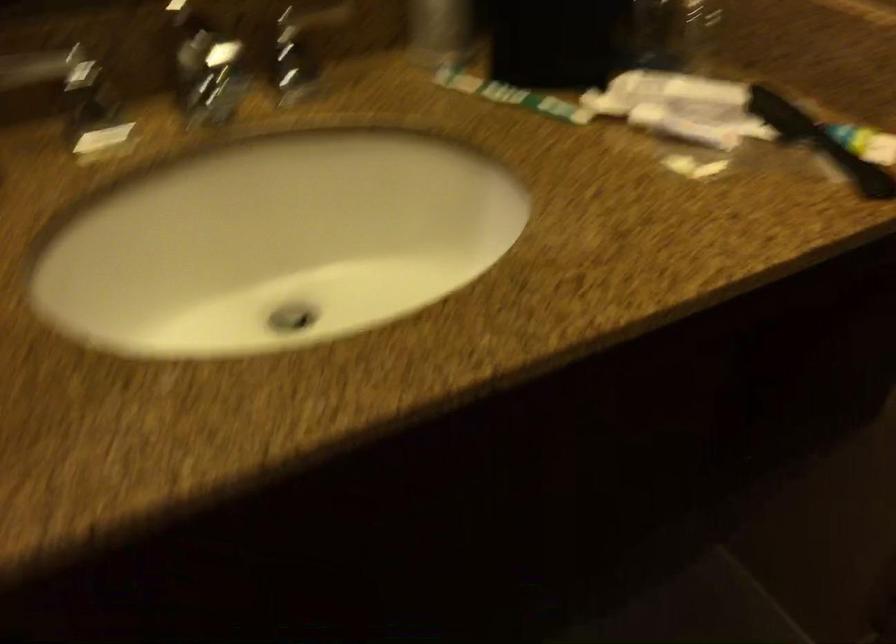
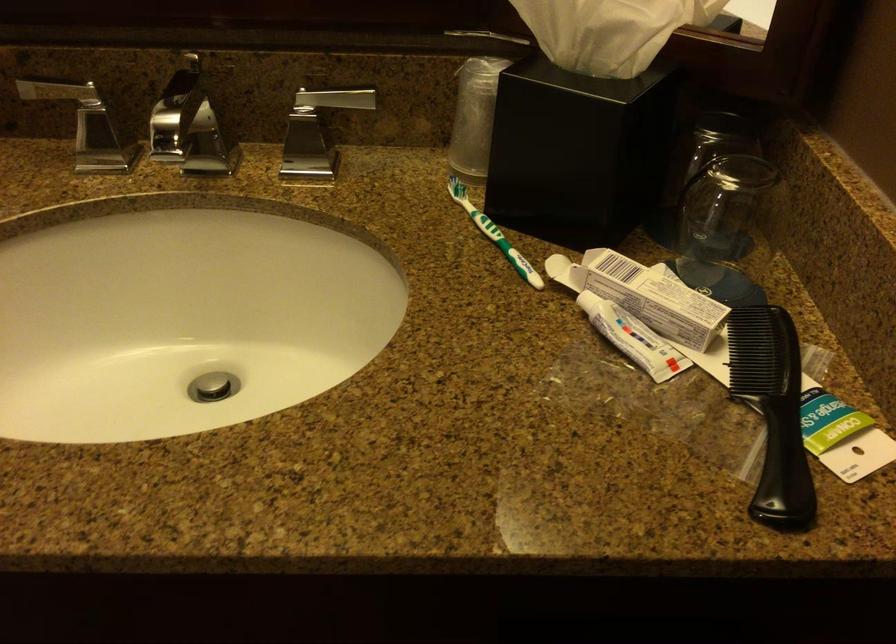
In the second image, find the point that corresponds to (x=694, y=125) in the first image.

(633, 337)